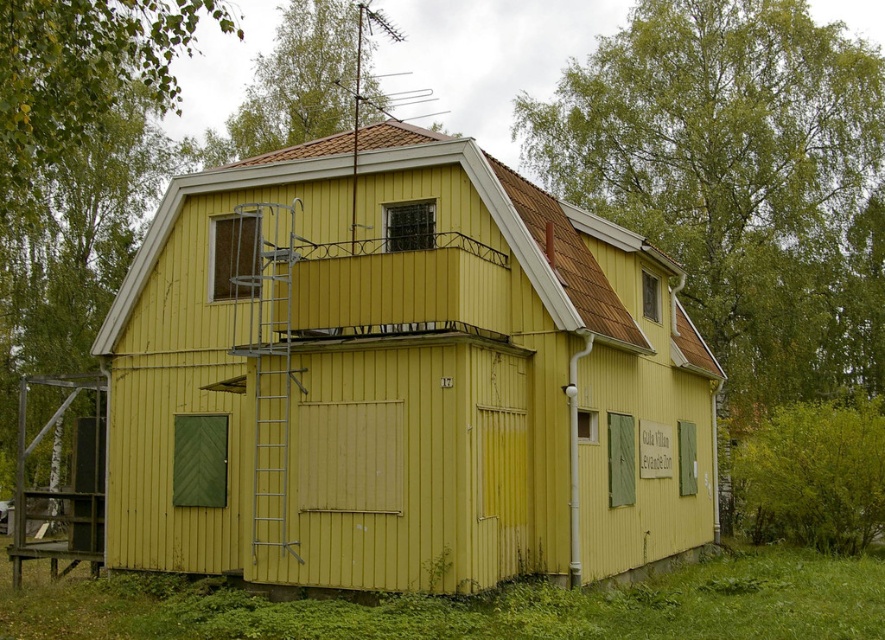
You are standing in front of the yellow wood cabin at center and want to reach the second floor window. The silver metallic ladder at center is your only option. Can you use the ladder to reach the window?

The yellow wood cabin at center is in front of the silver metallic ladder at center, so the ladder is behind the cabin and not accessible from the front. Therefore, you cannot use the ladder to reach the second floor window.

You are a painter standing on the ground floor of the yellow wood cabin at center. You need to paint the highest point of the cabin but your ladder is only 2 meters long. The wooden scaffolding at left is 1.5 meters tall. Can you reach the highest point using the scaffolding?

The yellow wood cabin at center is much taller than the wooden scaffolding at left. Since the scaffolding is only 1.5 meters tall, it won not provide enough height to reach the highest point of the cabin, which is significantly taller. Therefore, you cannot reach the highest point using the scaffolding.